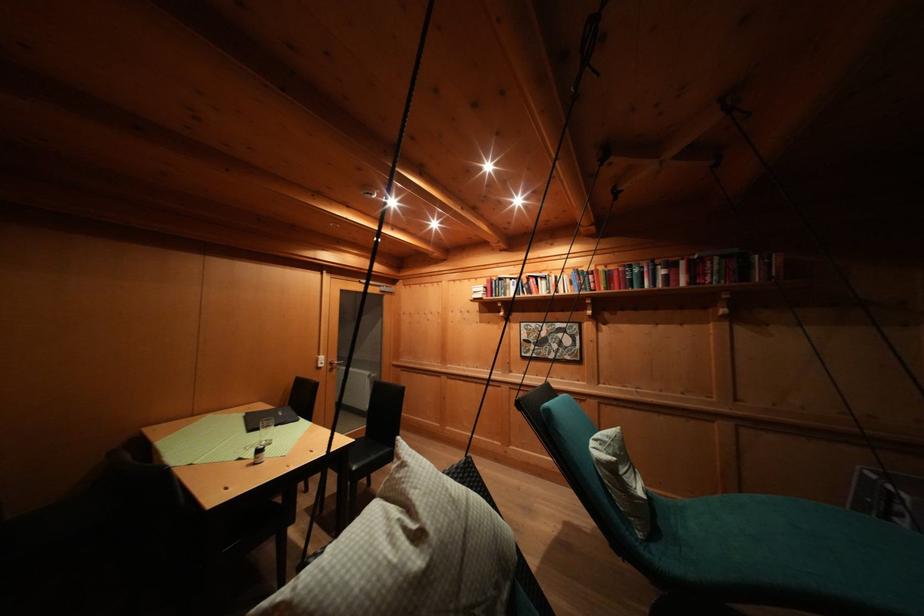
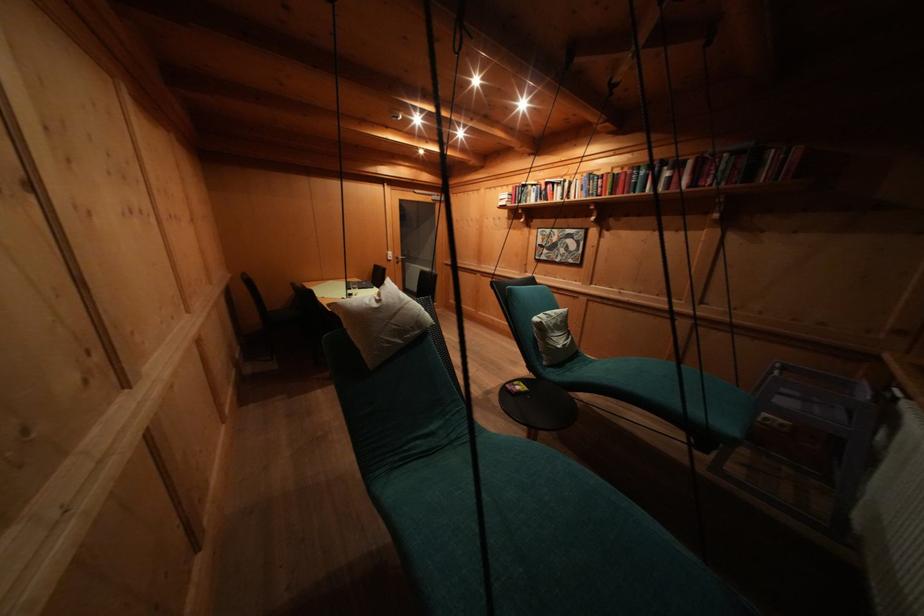
The images are taken continuously from a first-person perspective. In which direction is your viewpoint rotating?

The camera rotated toward left-down.